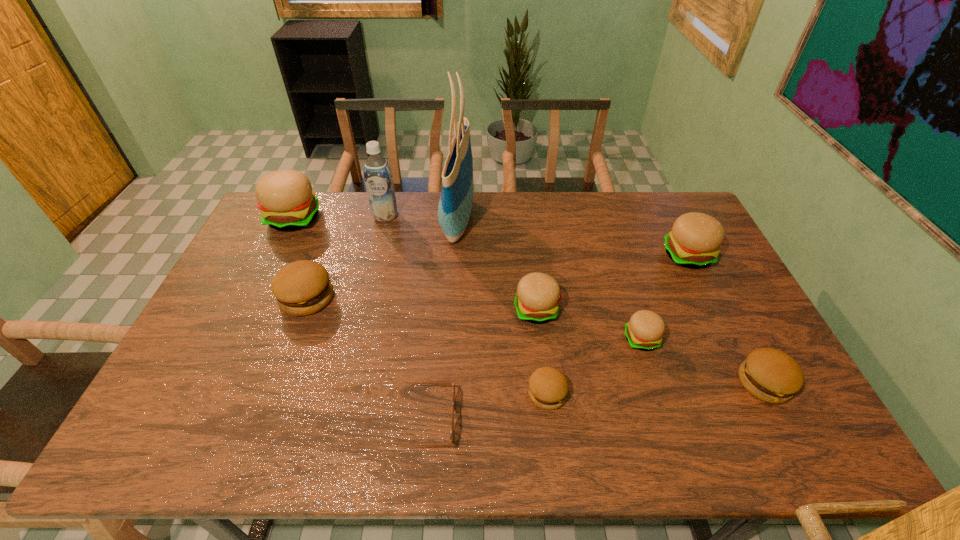
This screenshot has width=960, height=540. I want to click on the biggest brown hamburger, so click(301, 288).

Find the location of `the second biggest brown hamburger`. the second biggest brown hamburger is located at coordinates (770, 375).

Where is `the second beige hamburger from right to left`? The height and width of the screenshot is (540, 960). the second beige hamburger from right to left is located at coordinates (644, 331).

At what (x,y) coordinates should I click in order to perform the action: click on the fifth hamburger from left to right. Please return your answer as a coordinate pair (x, y). Looking at the image, I should click on (644, 331).

In order to click on the shortest hamburger in this screenshot , I will do `click(548, 387)`.

Locate an element on the screen. This screenshot has width=960, height=540. the smallest brown hamburger is located at coordinates (548, 387).

Find the location of a particular element. the shortest object is located at coordinates (437, 383).

Find the location of a particular element. Image resolution: width=960 pixels, height=540 pixels. sunglasses is located at coordinates (437, 383).

Identify the location of vacant region located on the left of the tote bag. (357, 221).

Locate an element on the screen. free point located on the label of the soya milk is located at coordinates (364, 301).